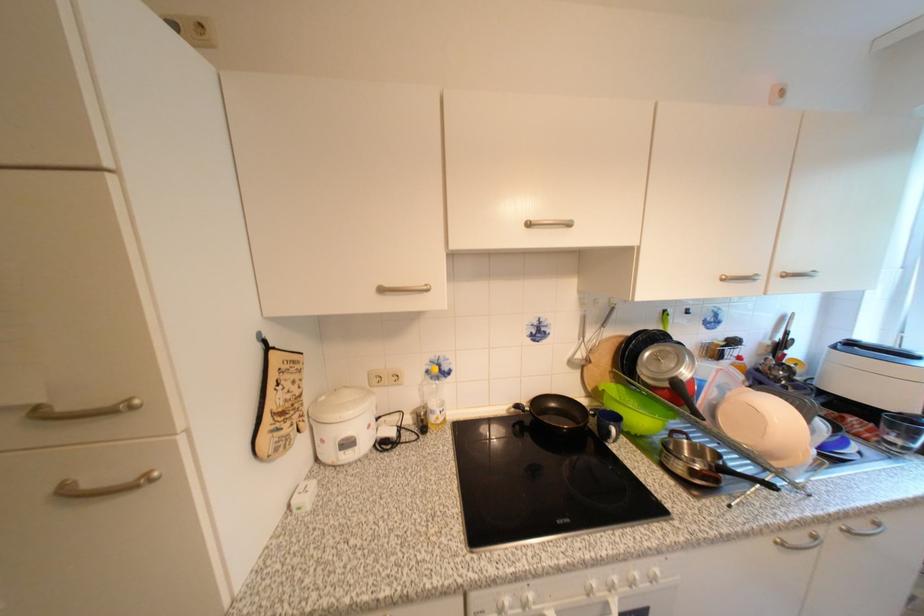
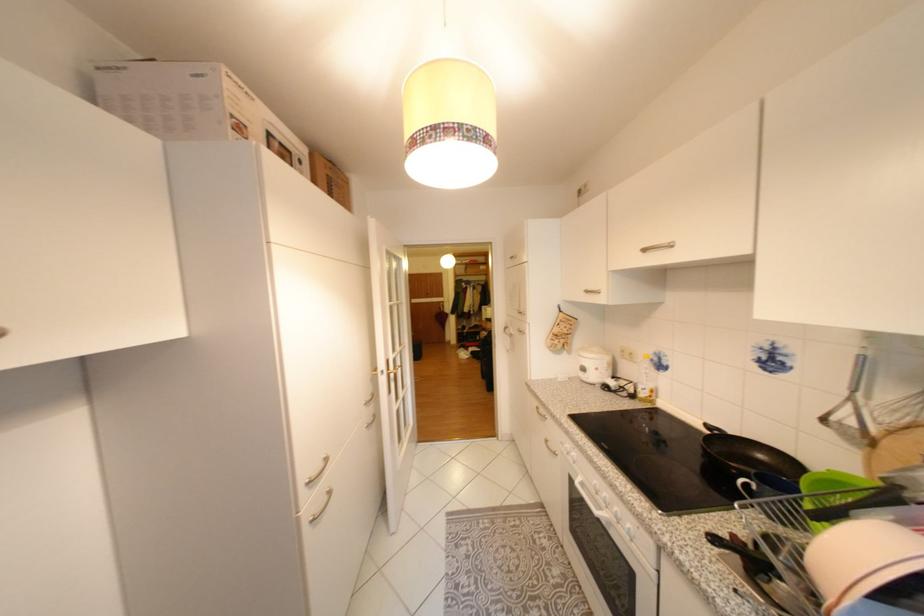
Locate, in the second image, the point that corresponds to the point at 357,445 in the first image.

(592, 370)